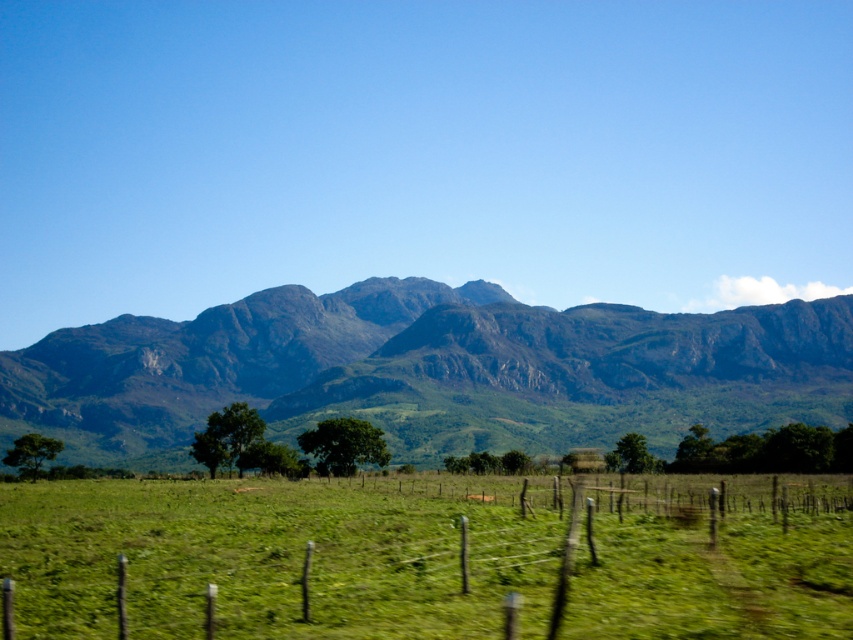
Question: Among these objects, which one is farthest from the camera?

Choices:
 (A) green textured mountain range at center
 (B) green grassy field at center

Answer: (A)

Question: Among these objects, which one is farthest from the camera?

Choices:
 (A) green grassy field at center
 (B) green textured mountain range at center

Answer: (B)

Question: Is green grassy field at center wider than green textured mountain range at center?

Choices:
 (A) yes
 (B) no

Answer: (B)

Question: Is green grassy field at center to the right of green textured mountain range at center from the viewer's perspective?

Choices:
 (A) yes
 (B) no

Answer: (B)

Question: Can you confirm if green grassy field at center is positioned to the right of green textured mountain range at center?

Choices:
 (A) yes
 (B) no

Answer: (B)

Question: Which of the following is the closest to the observer?

Choices:
 (A) (567, 438)
 (B) (196, 604)

Answer: (B)